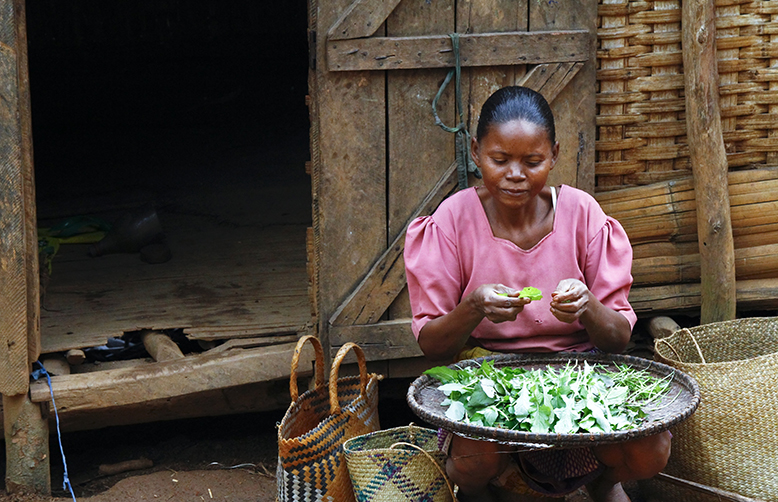
This screenshot has height=502, width=778. Identify the location of brown door. (401, 10).